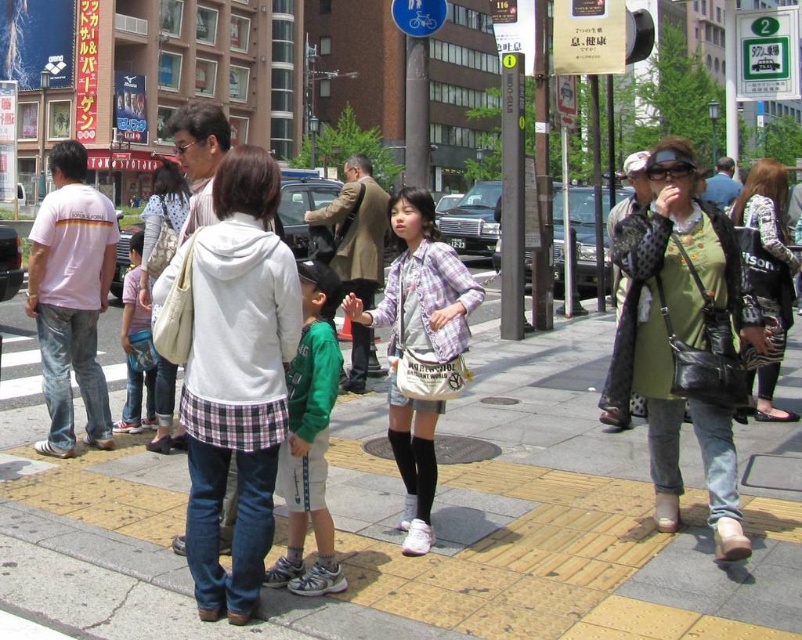
You are a tailor who needs to determine which clothing item requires more fabric for alterations. Based on the scene, which item has a greater width between the white cotton hoodie at center and the light pink cotton shirt at center?

The white cotton hoodie at center has a greater width than the light pink cotton shirt at center, so it would require more fabric for alterations.

You are a delivery person carrying a box that is 2.5 meters long. You need to navigate through the crowd on the bustling urban street scene. Is there enough space between the white cotton hoodie at center and the light pink cotton shirt at center to pass through with your box?

The white cotton hoodie at center and light pink cotton shirt at center are 2.48 meters apart. Since the box is 2.5 meters long, it is slightly longer than the available space. Therefore, the box cannot pass through the gap between them.

You are a delivery person who needs to place a package on the yellow brick pavement at center. You are currently holding the white cotton hoodie at center. Can you safely place the package on the pavement without moving the hoodie?

The yellow brick pavement at center is 5.27 feet away from the white cotton hoodie at center. Since the distance between them is over 5 feet, you can safely place the package on the pavement without moving the hoodie.